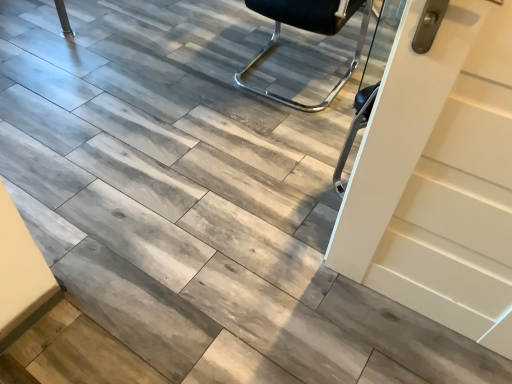
The image size is (512, 384). In order to click on white glossy door at right in this screenshot , I will do `click(439, 177)`.

This screenshot has width=512, height=384. Describe the element at coordinates (439, 177) in the screenshot. I see `white glossy door at right` at that location.

What do you see at coordinates (309, 31) in the screenshot?
I see `black leather chair at center` at bounding box center [309, 31].

Measure the distance between black leather chair at center and camera.

2.30 meters.

Locate an element on the screen. This screenshot has width=512, height=384. black leather chair at center is located at coordinates (309, 31).

Find the location of `white glossy door at right`. white glossy door at right is located at coordinates (439, 177).

Considering the relative positions of white glossy door at right and black leather chair at center in the image provided, is white glossy door at right to the left of black leather chair at center from the viewer's perspective?

Incorrect, white glossy door at right is not on the left side of black leather chair at center.

Consider the image. Is the depth of white glossy door at right greater than that of black leather chair at center?

That is False.

Is point (386, 66) positioned behind point (244, 74)?

That is False.

From the image's perspective, relative to black leather chair at center, is white glossy door at right above or below?

From the image's perspective, white glossy door at right appears below black leather chair at center.

From a real-world perspective, which is physically above, white glossy door at right or black leather chair at center?

In real-world perspective, white glossy door at right is above.

Is white glossy door at right wider than black leather chair at center?

Incorrect, the width of white glossy door at right does not surpass that of black leather chair at center.

From their relative heights in the image, would you say white glossy door at right is taller or shorter than black leather chair at center?

white glossy door at right is taller than black leather chair at center.

Who is smaller, white glossy door at right or black leather chair at center?

white glossy door at right.

Can we say white glossy door at right lies outside black leather chair at center?

white glossy door at right is positioned outside black leather chair at center.

Is white glossy door at right next to black leather chair at center and touching it?

No, white glossy door at right is not in contact with black leather chair at center.

Is white glossy door at right aimed at black leather chair at center?

No, white glossy door at right does not turn towards black leather chair at center.

How different are the orientations of white glossy door at right and black leather chair at center in degrees?

180 degrees separate the facing orientations of white glossy door at right and black leather chair at center.

How distant is white glossy door at right from black leather chair at center?

A distance of 4.40 feet exists between white glossy door at right and black leather chair at center.

Locate an element on the screen. door below the black leather chair at center (from the image's perspective) is located at coordinates (439, 177).

From the picture: Which is more to the left, black leather chair at center or white glossy door at right?

From the viewer's perspective, black leather chair at center appears more on the left side.

Is black leather chair at center further to camera compared to white glossy door at right?

Yes, the depth of black leather chair at center is greater than that of white glossy door at right.

Is point (351, 74) positioned in front of point (402, 32)?

No, it is behind (402, 32).

From the image's perspective, between black leather chair at center and white glossy door at right, who is located below?

white glossy door at right appears lower in the image.

From a real-world perspective, is black leather chair at center physically located above or below white glossy door at right?

From a real-world perspective, black leather chair at center is physically below white glossy door at right.

Between black leather chair at center and white glossy door at right, which one has larger width?

With larger width is black leather chair at center.

Which of these two, black leather chair at center or white glossy door at right, stands taller?

white glossy door at right.

In terms of size, does black leather chair at center appear bigger or smaller than white glossy door at right?

In the image, black leather chair at center appears to be larger than white glossy door at right.

Is black leather chair at center situated inside white glossy door at right or outside?

black leather chair at center is not enclosed by white glossy door at right.

Is black leather chair at center positioned far away from white glossy door at right?

Indeed, black leather chair at center is not near white glossy door at right.

Is black leather chair at center aimed at white glossy door at right?

No, black leather chair at center is not oriented towards white glossy door at right.

Measure the distance from black leather chair at center to white glossy door at right.

A distance of 1.34 meters exists between black leather chair at center and white glossy door at right.

The width and height of the screenshot is (512, 384). Identify the location of door below the black leather chair at center (from the image's perspective). (439, 177).

The width and height of the screenshot is (512, 384). Find the location of `door on the right of black leather chair at center`. door on the right of black leather chair at center is located at coordinates tap(439, 177).

You are a GUI agent. You are given a task and a screenshot of the screen. Output one action in this format:
    pyautogui.click(x=<x>, y=<y>)
    Task: Click on the door in front of the black leather chair at center
    
    Given the screenshot: What is the action you would take?
    pyautogui.click(x=439, y=177)